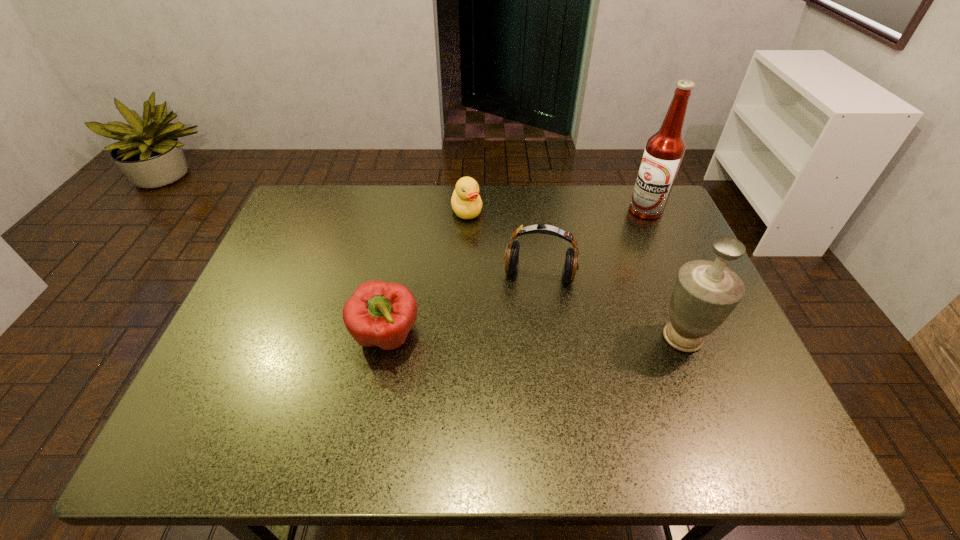
The height and width of the screenshot is (540, 960). I want to click on vacant space that is in between the fourth shortest object and the leftmost object, so click(535, 337).

The width and height of the screenshot is (960, 540). In order to click on blank region between the third farthest object and the urn in this screenshot , I will do `click(611, 306)`.

Locate an element on the screen. This screenshot has height=540, width=960. vacant area that lies between the bell pepper and the alcohol is located at coordinates (516, 273).

The height and width of the screenshot is (540, 960). Find the location of `free space between the leftmost object and the tallest object`. free space between the leftmost object and the tallest object is located at coordinates (516, 273).

Identify the location of vacant space that is in between the tallest object and the leftmost object. This screenshot has width=960, height=540. (516, 273).

This screenshot has height=540, width=960. I want to click on free space between the leftmost object and the third farthest object, so click(463, 306).

Image resolution: width=960 pixels, height=540 pixels. I want to click on free space between the duck and the third object from right to left, so click(503, 243).

Locate which object is the third closest to the shortest object. Please provide its 2D coordinates. Your answer should be formatted as a tuple, i.e. [(x, y)], where the tuple contains the x and y coordinates of a point satisfying the conditions above.

[(664, 151)]

Choose which object is the nearest neighbor to the second tallest object. Please provide its 2D coordinates. Your answer should be formatted as a tuple, i.e. [(x, y)], where the tuple contains the x and y coordinates of a point satisfying the conditions above.

[(511, 257)]

This screenshot has width=960, height=540. What are the coordinates of `blank space that satisfies the following two spatial constraints: 1. on the front side of the fourth shortest object; 2. on the right side of the duck` in the screenshot? It's located at (463, 338).